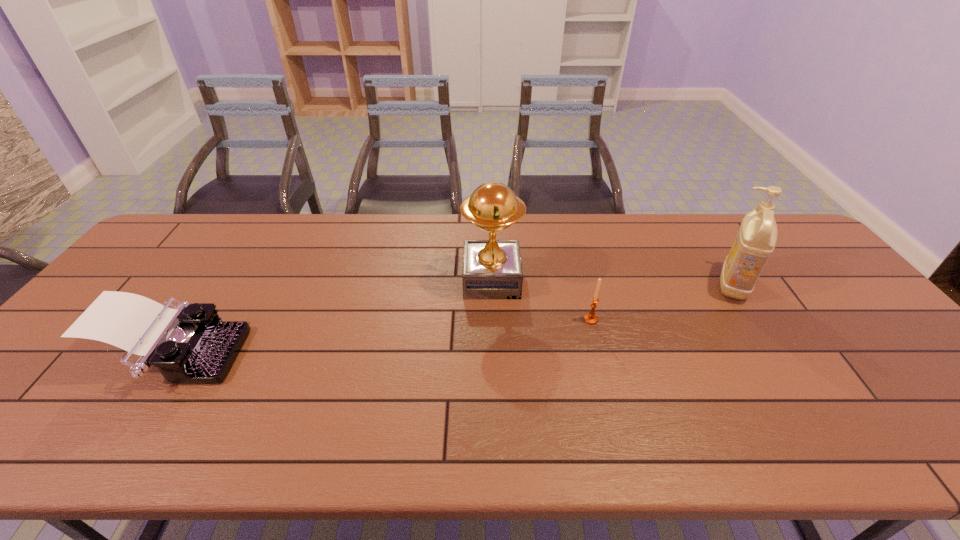
What are the coordinates of `vacant space that's between the second object from left to right and the rightmost object` in the screenshot? It's located at (612, 282).

You are a GUI agent. You are given a task and a screenshot of the screen. Output one action in this format:
    pyautogui.click(x=<x>, y=<y>)
    Task: Click on the free space between the detergent and the third object from right to left
    The width and height of the screenshot is (960, 540).
    Given the screenshot: What is the action you would take?
    pyautogui.click(x=612, y=282)

Find the location of `free space between the detergent and the second object from left to right`. free space between the detergent and the second object from left to right is located at coordinates pyautogui.click(x=612, y=282).

Locate an element on the screen. unoccupied area between the leftmost object and the rightmost object is located at coordinates (455, 321).

You are a GUI agent. You are given a task and a screenshot of the screen. Output one action in this format:
    pyautogui.click(x=<x>, y=<y>)
    Task: Click on the free spot between the second object from left to right and the leftmost object
    
    Given the screenshot: What is the action you would take?
    pyautogui.click(x=334, y=319)

Select which object is the second closest to the candle_holder. Please provide its 2D coordinates. Your answer should be formatted as a tuple, i.e. [(x, y)], where the tuple contains the x and y coordinates of a point satisfying the conditions above.

[(755, 242)]

Where is `object that is the closest to the detergent`? object that is the closest to the detergent is located at coordinates (591, 318).

This screenshot has height=540, width=960. Identify the location of vacant region that satisfies the following two spatial constraints: 1. on the front-facing side of the award; 2. on the left side of the candle_holder. pyautogui.click(x=492, y=320).

At what (x,y) coordinates should I click in order to perform the action: click on free space that satisfies the following two spatial constraints: 1. on the back side of the third object from left to right; 2. on the right side of the detergent. Please return your answer as a coordinate pair (x, y). The width and height of the screenshot is (960, 540). Looking at the image, I should click on (582, 285).

Locate an element on the screen. free space that satisfies the following two spatial constraints: 1. on the front-facing side of the candle_holder; 2. on the right side of the third object from right to left is located at coordinates (492, 320).